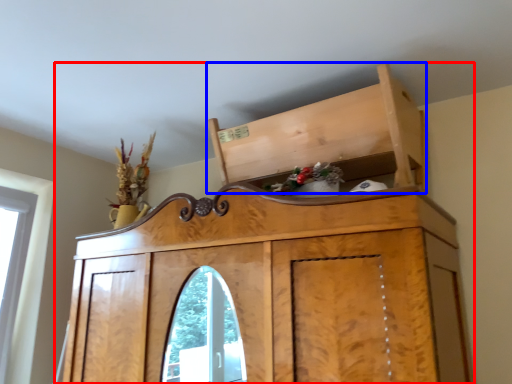
Question: Which object appears closest to the camera in this image, furniture (highlighted by a red box) or cabinetry (highlighted by a blue box)?

Choices:
 (A) furniture
 (B) cabinetry

Answer: (A)